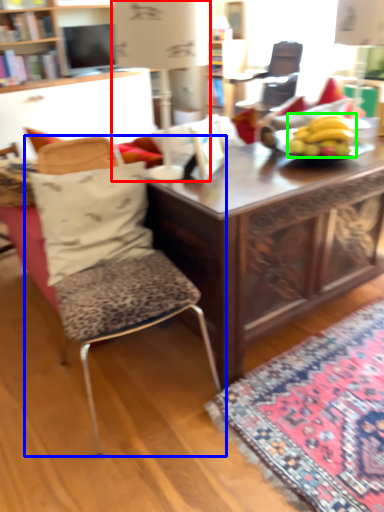
Question: Which object is the closest to the table lamp (highlighted by a red box)? Choose among these: chair (highlighted by a blue box) or banana (highlighted by a green box).

Choices:
 (A) chair
 (B) banana

Answer: (B)